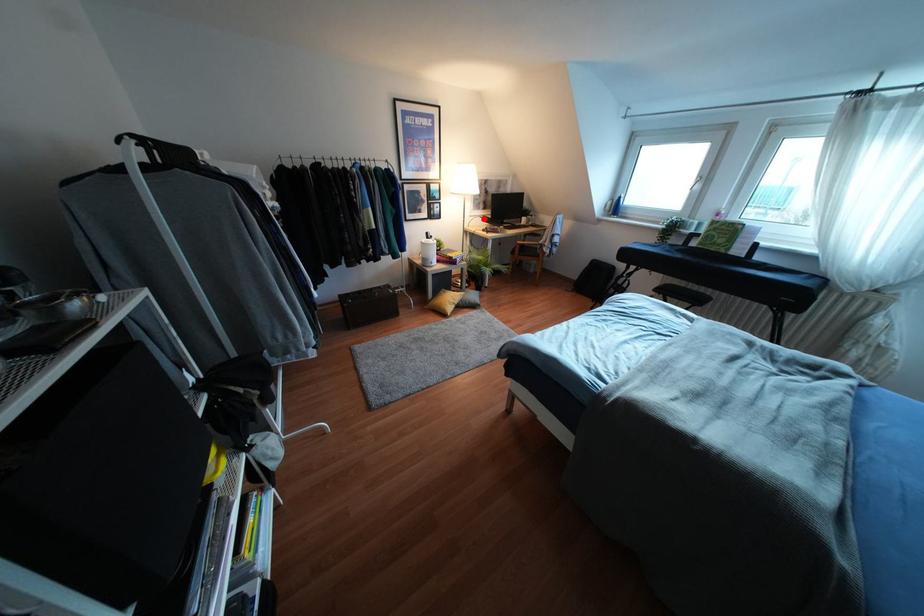
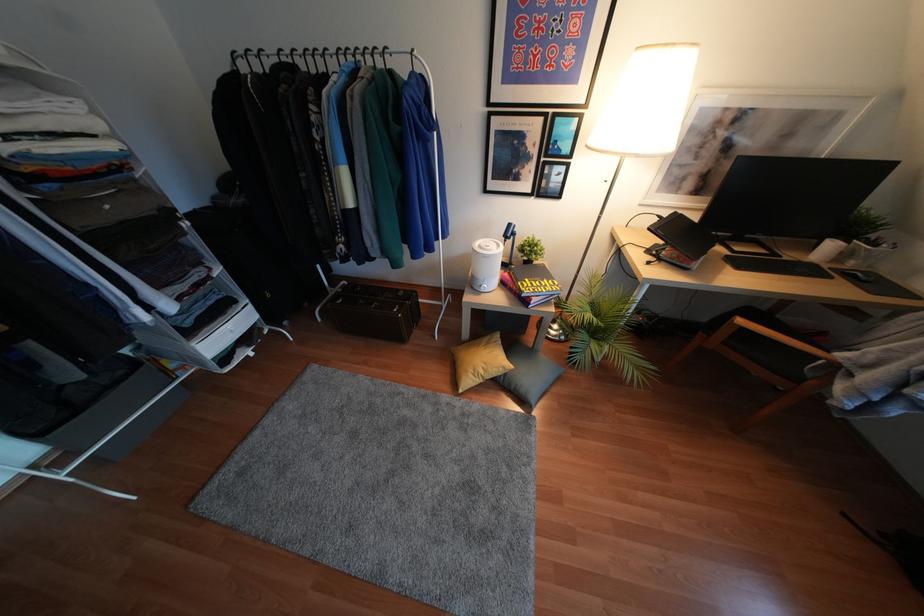
Question: A red point is marked in image1. In image2, is the corresponding 3D point closer to the camera or farther? Reply with the corresponding letter.

Choices:
 (A) The corresponding 3D point is closer.
 (B) The corresponding 3D point is farther.

Answer: (B)